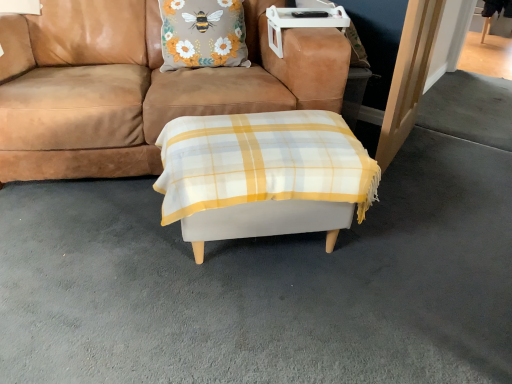
Question: Is white fabric ottoman at center bigger than brown suede couch at center?

Choices:
 (A) no
 (B) yes

Answer: (A)

Question: Does white fabric ottoman at center appear on the left side of brown suede couch at center?

Choices:
 (A) no
 (B) yes

Answer: (A)

Question: From the image's perspective, is white fabric ottoman at center on top of brown suede couch at center?

Choices:
 (A) yes
 (B) no

Answer: (B)

Question: Considering the relative positions of white fabric ottoman at center and brown suede couch at center in the image provided, is white fabric ottoman at center in front of brown suede couch at center?

Choices:
 (A) yes
 (B) no

Answer: (A)

Question: Would you consider white fabric ottoman at center to be distant from brown suede couch at center?

Choices:
 (A) no
 (B) yes

Answer: (A)

Question: From the image's perspective, is white fabric ottoman at center above or below floral fabric pillow at upper center?

Choices:
 (A) above
 (B) below

Answer: (B)

Question: Considering their positions, is white fabric ottoman at center located in front of or behind floral fabric pillow at upper center?

Choices:
 (A) front
 (B) behind

Answer: (A)

Question: Considering the relative positions of white fabric ottoman at center and floral fabric pillow at upper center in the image provided, is white fabric ottoman at center to the left or to the right of floral fabric pillow at upper center?

Choices:
 (A) left
 (B) right

Answer: (B)

Question: Is point (282, 200) positioned closer to the camera than point (200, 56)?

Choices:
 (A) farther
 (B) closer

Answer: (B)

Question: In terms of width, does brown suede couch at center look wider or thinner when compared to white fabric ottoman at center?

Choices:
 (A) wide
 (B) thin

Answer: (A)

Question: In the image, is brown suede couch at center positioned in front of or behind white fabric ottoman at center?

Choices:
 (A) behind
 (B) front

Answer: (A)

Question: From a real-world perspective, is brown suede couch at center above or below white fabric ottoman at center?

Choices:
 (A) above
 (B) below

Answer: (A)

Question: From the image's perspective, relative to white fabric ottoman at center, is brown suede couch at center above or below?

Choices:
 (A) below
 (B) above

Answer: (B)

Question: Is floral fabric pillow at upper center inside or outside of white fabric ottoman at center?

Choices:
 (A) inside
 (B) outside

Answer: (B)

Question: Does point (245, 56) appear closer or farther from the camera than point (226, 140)?

Choices:
 (A) farther
 (B) closer

Answer: (A)